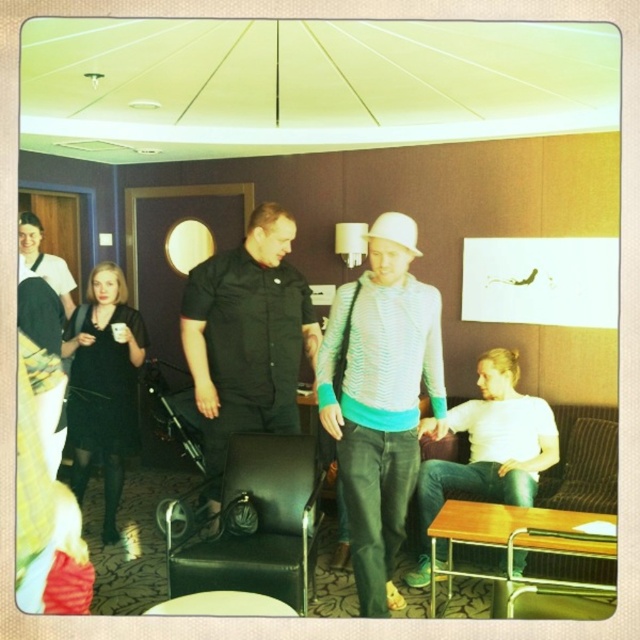
You are standing in the hotel room and need to find the knitted sweater at center. According to the coordinates provided, where should you look to find it?

The knitted sweater at center is located at coordinates point [380,400], so you should look towards the center of the room slightly to the right and upper middle area.

Looking at this image, you are a guest in the hotel room and want to sit down on the smooth black stool at lower center. However, there is a white matte hat at center in the way. Can you move the hat to the right to make space for the stool?

The smooth black stool at lower center is already positioned on the left side of the white matte hat at center, so moving the hat to the right would place it further away from the stool, making more space.